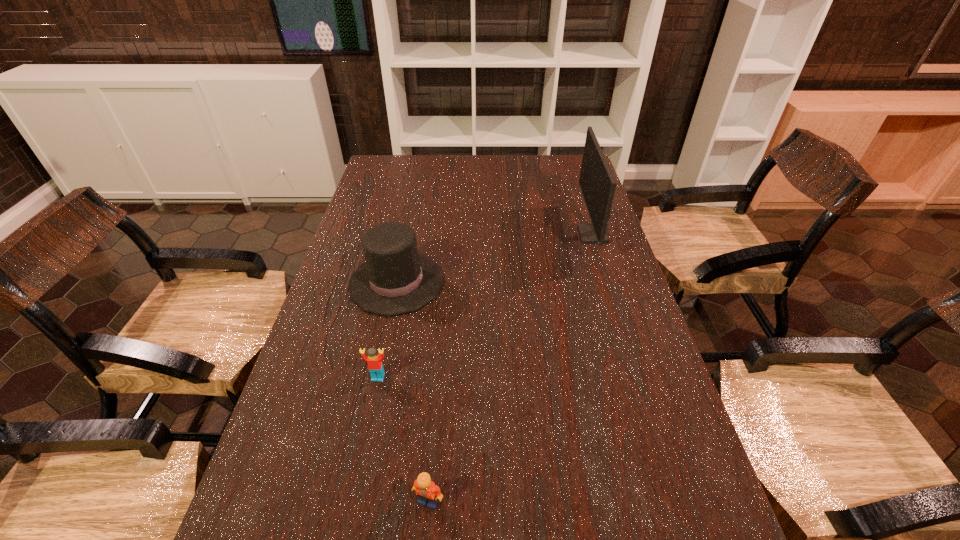
Identify the location of vacant space that satisfies the following two spatial constraints: 1. on the front-facing side of the tallest object; 2. on the face of the third farthest object. The height and width of the screenshot is (540, 960). click(638, 377).